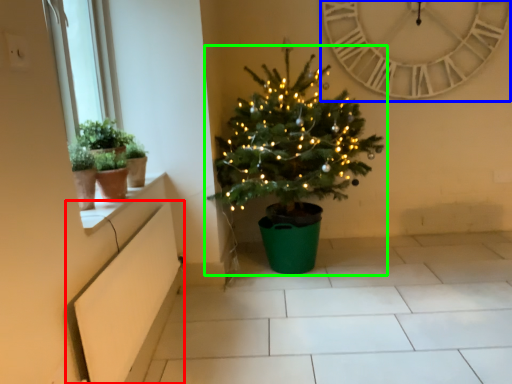
Question: Which is farther away from window box (highlighted by a red box)? clock (highlighted by a blue box) or christmas tree (highlighted by a green box)?

Choices:
 (A) clock
 (B) christmas tree

Answer: (A)